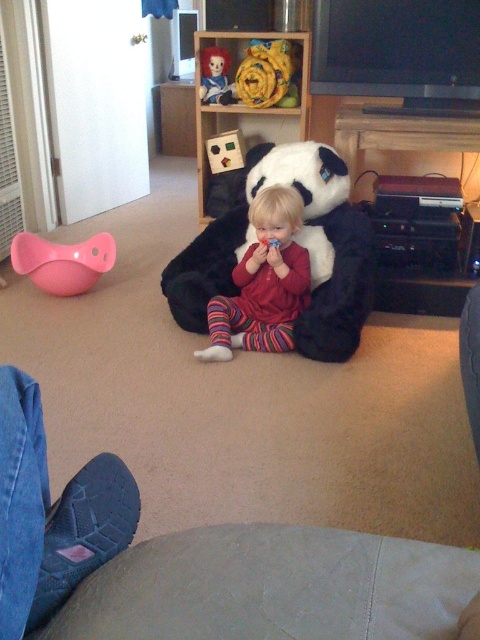
Does striped fleece pajamas at center appear on the left side of fluffy yellow fabric at upper center?

Indeed, striped fleece pajamas at center is positioned on the left side of fluffy yellow fabric at upper center.

Is point (278, 218) positioned before point (264, 74)?

Yes.

Locate an element on the screen. Image resolution: width=480 pixels, height=640 pixels. striped fleece pajamas at center is located at coordinates (264, 282).

Is the position of soft plush panda at center less distant than that of pink rubber pacifier at left?

Yes.

Is point (317, 268) positioned behind point (50, 252)?

No.

Where is `soft plush panda at center`? soft plush panda at center is located at coordinates (296, 241).

Can you confirm if pink rubber pacifier at left is taller than fluffy yellow fabric at upper center?

Incorrect, pink rubber pacifier at left's height is not larger of fluffy yellow fabric at upper center's.

Between pink rubber pacifier at left and fluffy yellow fabric at upper center, which one has more height?

With more height is fluffy yellow fabric at upper center.

Does point (60, 292) lie in front of point (266, 99)?

Yes, point (60, 292) is closer to viewer.

The image size is (480, 640). I want to click on pink rubber pacifier at left, so click(62, 260).